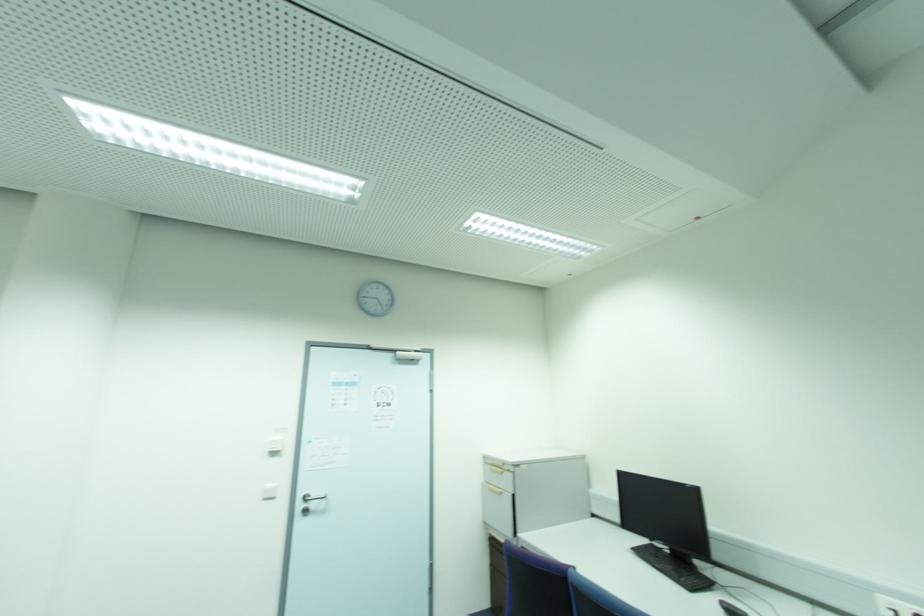
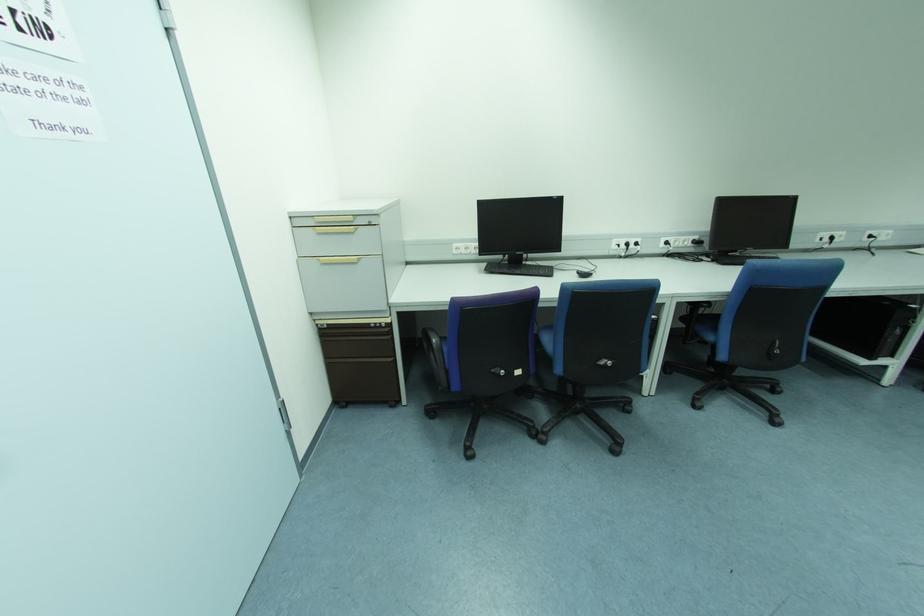
In the second image, find the point that corresponds to (502,464) in the first image.

(350, 219)